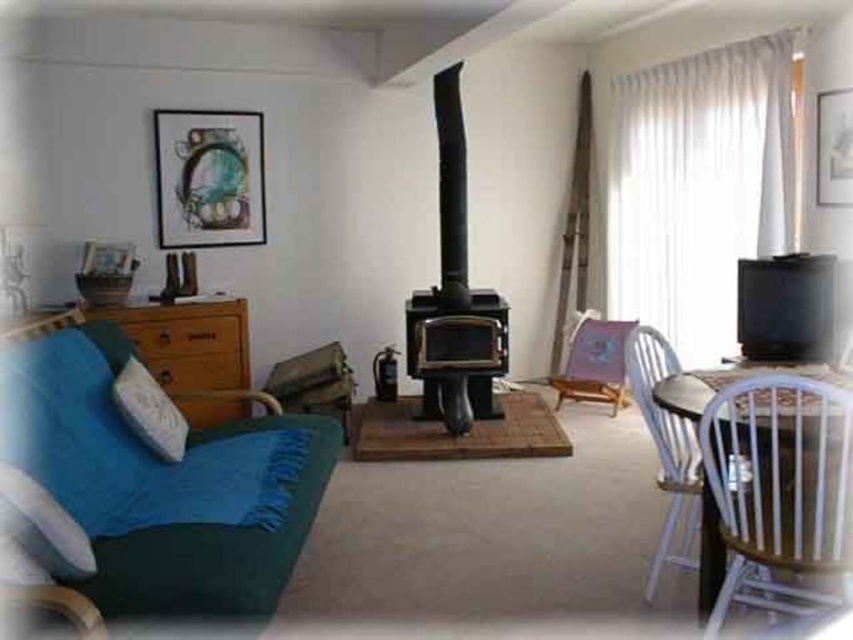
You are a delivery person who just arrived at the house. You need to place a package that is 2 meters long between the metallic silver picture frame at upper left and the white soft pillow at left. Is there enough space between them to fit the package?

The distance between the metallic silver picture frame at upper left and the white soft pillow at left is 1.88 meters. Since the package is 2 meters long, which is longer than the available space, the package cannot be placed between them.

You are standing at the center of the living space and want to sit down. There is a wooden spindle back chair at right located at point [666,449]. Can you walk directly to that chair without moving around any objects?

Yes, you can walk directly to the wooden spindle back chair at right located at point [666,449] because there are no objects blocking the path between the center of the living space and the chair.

You are planning to place a new coffee table in the living room. You have two options for placement. One is between the blue fabric couch at left and the wooden spindle back chair at right. The other is against the wall opposite the stove. Considering the size of the furniture, which placement might be more suitable for a coffee table?

The blue fabric couch at left is larger in size than the wooden spindle back chair at right, so placing the coffee table between them would allow for a more balanced arrangement given the size difference between the two pieces of furniture.